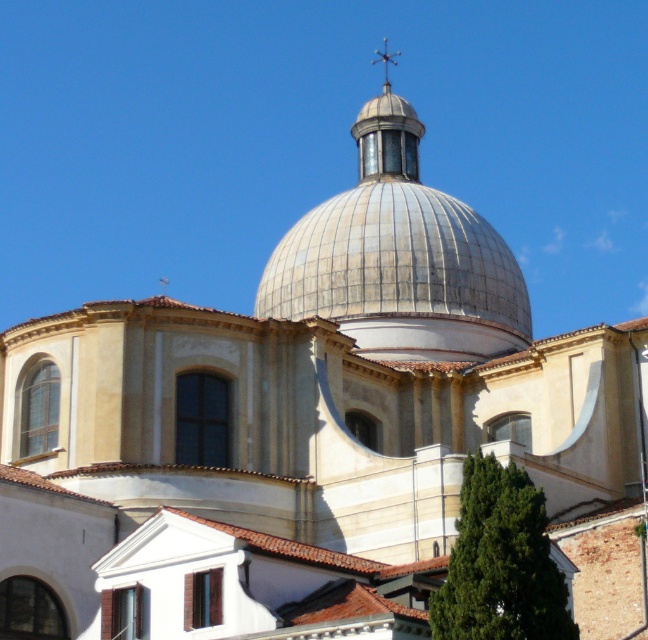
You are an architect analyzing the historic building. You notice the metallic silver dome at center and the metallic spire at center. Which of these two objects is positioned higher in the image?

The metallic spire at center is positioned higher than the metallic silver dome at center because the dome is below the spire according to the description.

You are a maintenance worker needing to inspect both the metallic silver dome at center and the metallic spire at center. Given that you have a ladder that can extend up to 15 meters, can you safely reach both structures with the ladder without needing to move it?

The distance between the metallic silver dome at center and the metallic spire at center is 15.21 meters. Since the ladder can only extend up to 15 meters, it is not long enough to safely reach both structures without moving it.